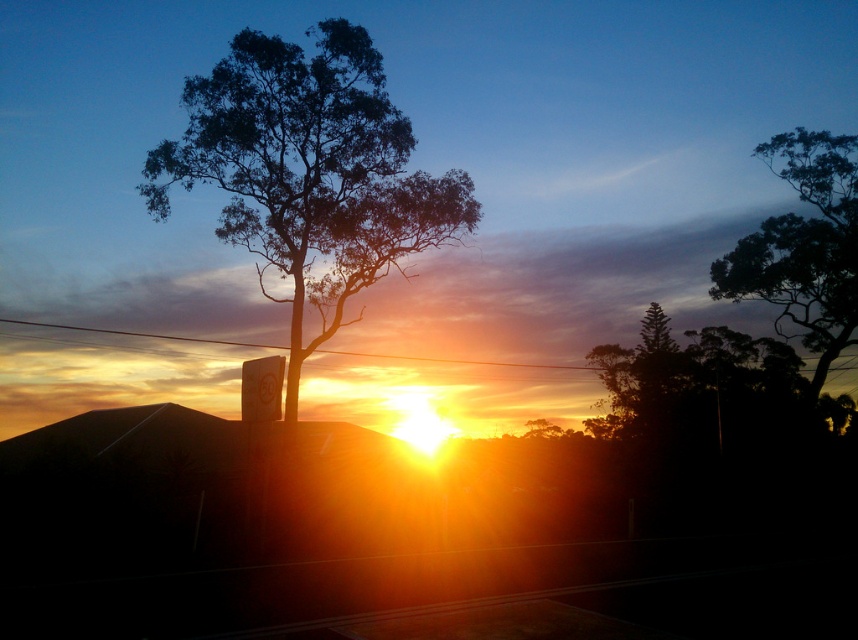
You are an artist trying to paint the sunset scene. You want to ensure the dark green leafy tree at center and the dark green leafy tree at upper right are positioned correctly according to their depth. Which tree should you paint first to create the illusion of depth?

You should paint the dark green leafy tree at center first because it is in front of the dark green leafy tree at upper right, so painting the foreground tree first will help create the illusion of depth.